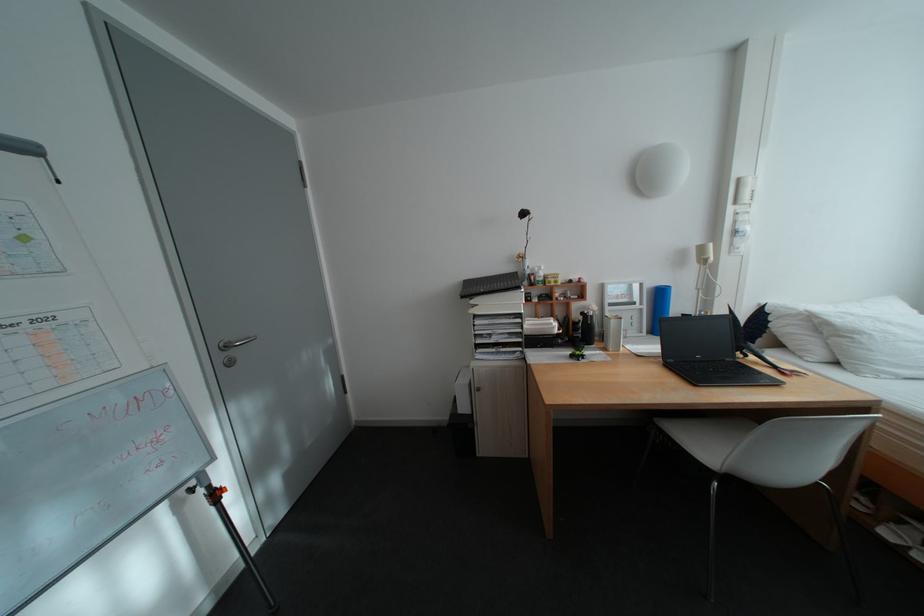
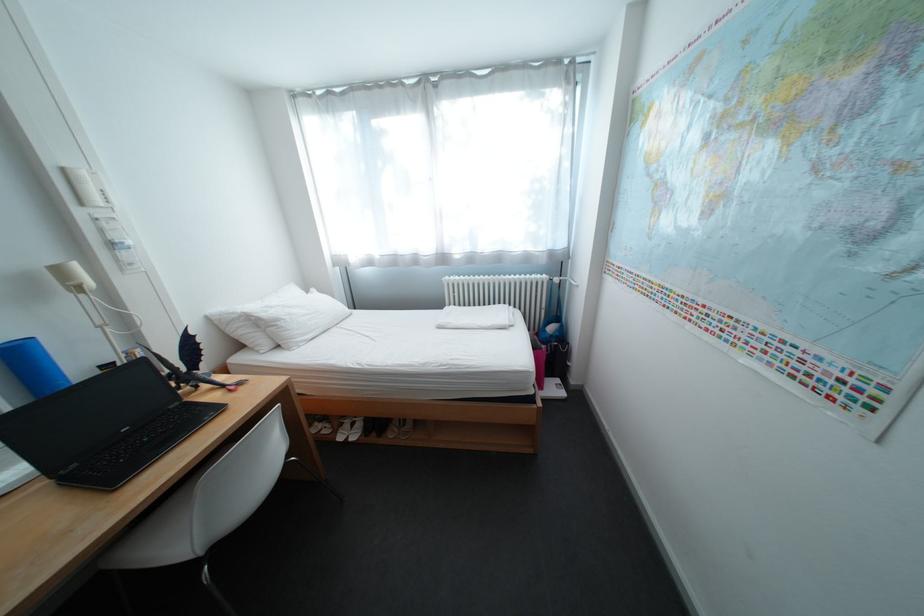
Where in the second image is the point corresponding to the point at 714,249 from the first image?

(71, 272)